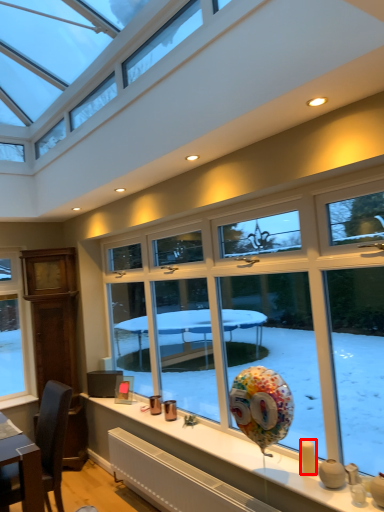
Question: Considering the relative positions of candle (annotated by the red box) and candle holder in the image provided, where is candle (annotated by the red box) located with respect to the staircase?

Choices:
 (A) right
 (B) left

Answer: (B)